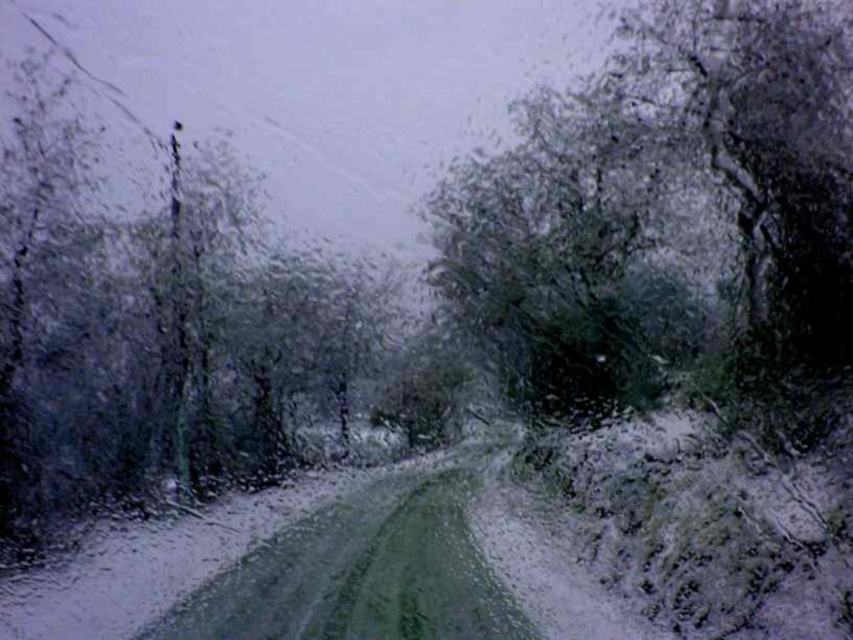
Describe the element at coordinates (670, 221) in the screenshot. The image size is (853, 640). I see `green matte tree at upper right` at that location.

Who is taller, green matte tree at upper right or glossy dark green tree at upper left?

With more height is glossy dark green tree at upper left.

Does point (592, 410) come closer to viewer compared to point (350, 332)?

Yes, point (592, 410) is closer to viewer.

What are the coordinates of `green matte tree at upper right` in the screenshot? It's located at (670, 221).